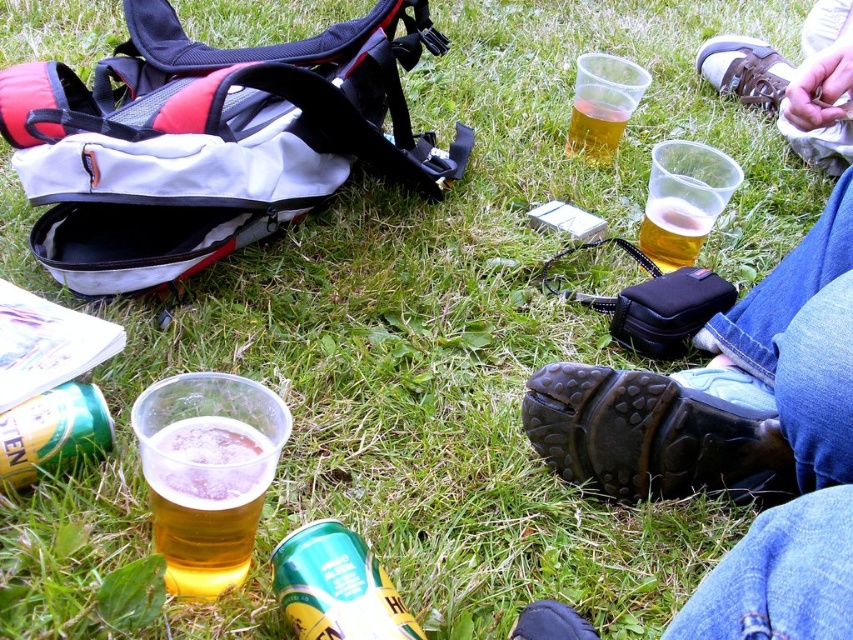
You are standing in the picnic area and need to find your shoes. Which shoe is positioned higher up in the image, the brown leather shoe at upper right or the black rubber shoe at lower center?

The brown leather shoe at upper right is located above the black rubber shoe at lower center in the image.

You need to place the green matte can at lower left inside the black rubber boot at lower center. Will it fit based on their widths?

The black rubber boot at lower center might be wider than green matte can at lower left, so there is a possibility that the green matte can at lower left could fit inside the black rubber boot at lower center. However, without exact measurements, this is uncertain.